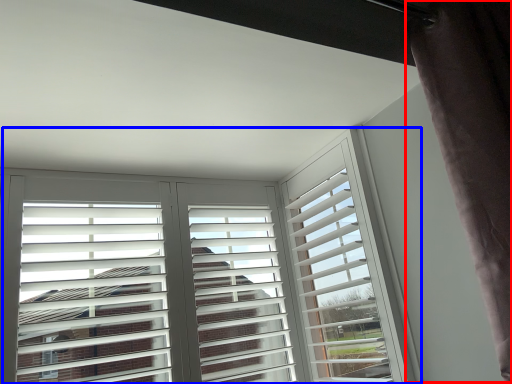
Question: Which of the following is the farthest to the observer, curtain (highlighted by a red box) or window (highlighted by a blue box)?

Choices:
 (A) curtain
 (B) window

Answer: (B)